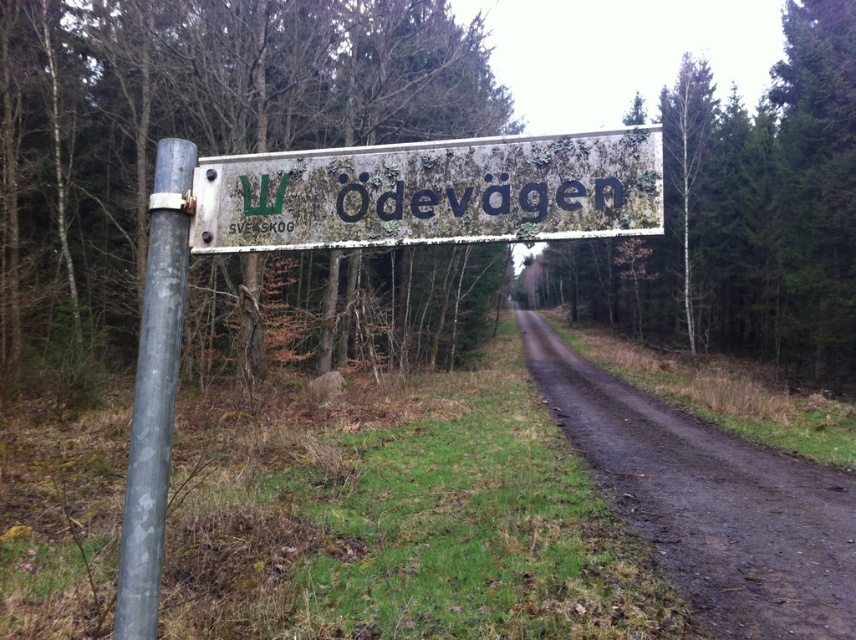
Question: In this image, where is green mossy sign at center located relative to green mossy tree at center?

Choices:
 (A) above
 (B) below

Answer: (B)

Question: Which object is farther from the camera taking this photo?

Choices:
 (A) rusty metal sign at center
 (B) smooth metallic pole at left

Answer: (B)

Question: Which point is farther to the camera?

Choices:
 (A) rusty metal sign at center
 (B) green mossy sign at center
 (C) green mossy tree at center
 (D) brown dirt track at center

Answer: (B)

Question: Which of these objects is positioned closest to the rusty metal sign at center?

Choices:
 (A) smooth metallic pole at left
 (B) green mossy tree at center

Answer: (A)

Question: Can you confirm if green mossy sign at center is thinner than smooth metallic pole at left?

Choices:
 (A) no
 (B) yes

Answer: (A)

Question: Is brown dirt track at center positioned at the back of smooth metallic pole at left?

Choices:
 (A) yes
 (B) no

Answer: (A)